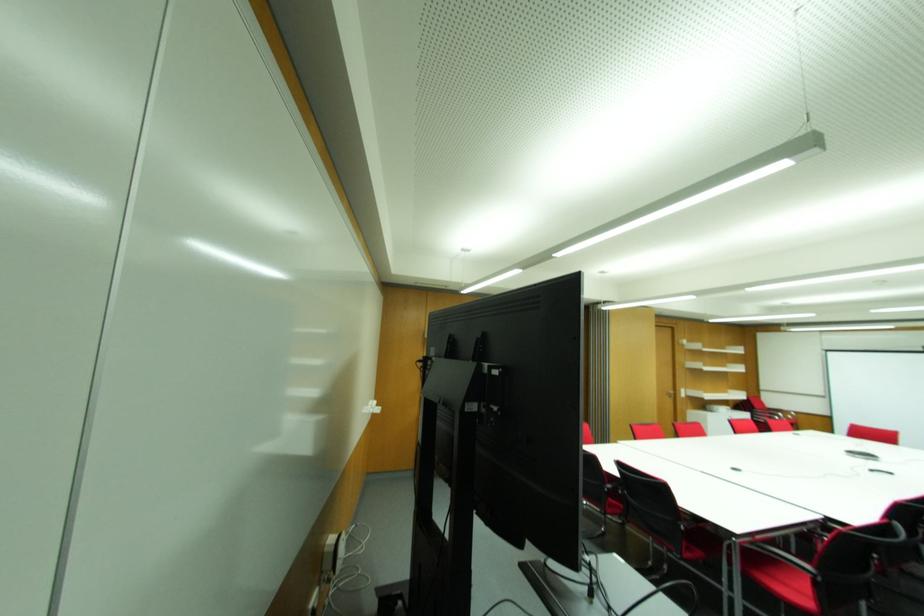
What do you see at coordinates (784, 557) in the screenshot? Image resolution: width=924 pixels, height=616 pixels. I see `a black chair armrest` at bounding box center [784, 557].